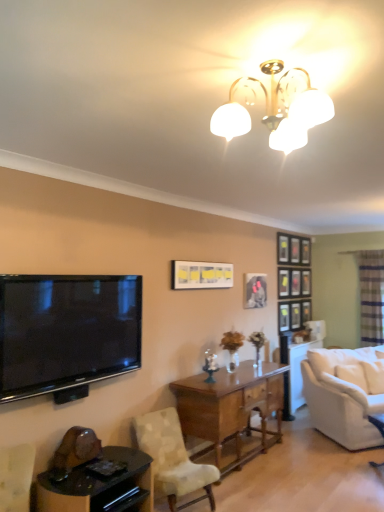
Question: Should I look upward or downward to see translucent glass door at right?

Choices:
 (A) down
 (B) up

Answer: (A)

Question: Considering the relative positions of translucent glass door at right and mahogany wood desk at center in the image provided, is translucent glass door at right to the right of mahogany wood desk at center from the viewer's perspective?

Choices:
 (A) yes
 (B) no

Answer: (A)

Question: Does translucent glass door at right touch mahogany wood desk at center?

Choices:
 (A) no
 (B) yes

Answer: (A)

Question: Can you confirm if translucent glass door at right is smaller than mahogany wood desk at center?

Choices:
 (A) no
 (B) yes

Answer: (B)

Question: From the image's perspective, is translucent glass door at right below mahogany wood desk at center?

Choices:
 (A) yes
 (B) no

Answer: (B)

Question: From a real-world perspective, is translucent glass door at right under mahogany wood desk at center?

Choices:
 (A) no
 (B) yes

Answer: (A)

Question: Can you confirm if translucent glass door at right is shorter than mahogany wood desk at center?

Choices:
 (A) yes
 (B) no

Answer: (B)

Question: Can you confirm if black glossy table at lower left is wider than light beige fabric chair at center?

Choices:
 (A) yes
 (B) no

Answer: (B)

Question: Is black glossy table at lower left behind light beige fabric chair at center?

Choices:
 (A) no
 (B) yes

Answer: (A)

Question: Can light beige fabric chair at center be found inside black glossy table at lower left?

Choices:
 (A) yes
 (B) no

Answer: (B)

Question: Is black glossy table at lower left positioned in front of light beige fabric chair at center?

Choices:
 (A) yes
 (B) no

Answer: (A)

Question: Is black glossy table at lower left positioned beyond the bounds of light beige fabric chair at center?

Choices:
 (A) yes
 (B) no

Answer: (A)

Question: Is black glossy table at lower left not close to light beige fabric chair at center?

Choices:
 (A) no
 (B) yes

Answer: (A)

Question: Would you say flat-screen tv at left is outside light beige fabric chair at center?

Choices:
 (A) no
 (B) yes

Answer: (B)